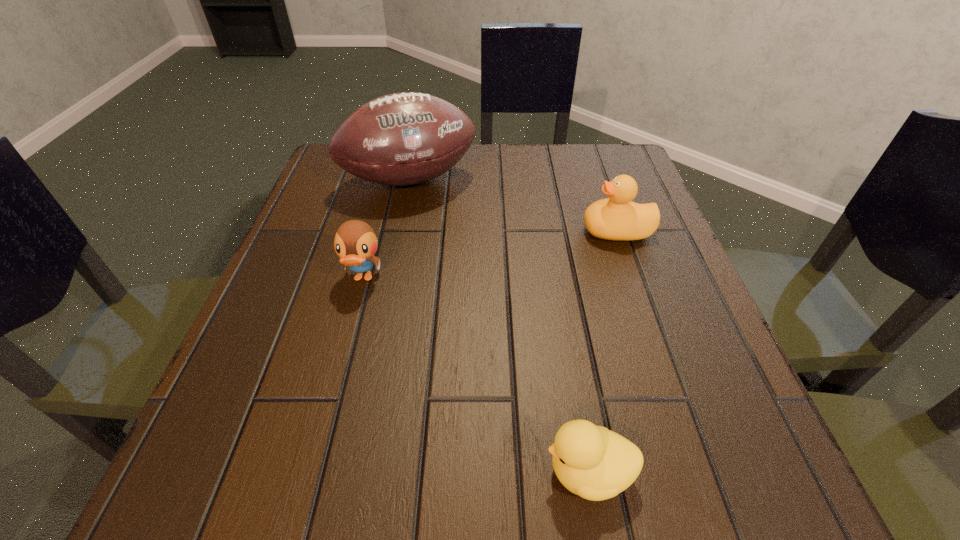
The width and height of the screenshot is (960, 540). I want to click on empty location between the shortest duck and the third nearest object, so click(603, 352).

Locate an element on the screen. vacant space that's between the nearest duck and the second farthest duck is located at coordinates (476, 375).

The image size is (960, 540). In order to click on free space between the rightmost object and the second object from right to left in this screenshot , I will do `click(603, 352)`.

Where is `empty space that is in between the farthest object and the leftmost duck`? This screenshot has height=540, width=960. empty space that is in between the farthest object and the leftmost duck is located at coordinates (386, 230).

Image resolution: width=960 pixels, height=540 pixels. What are the coordinates of `vacant space in between the football (American) and the farthest duck` in the screenshot? It's located at (514, 206).

Locate an element on the screen. blank region between the shortest duck and the farthest object is located at coordinates (499, 326).

You are a GUI agent. You are given a task and a screenshot of the screen. Output one action in this format:
    pyautogui.click(x=<x>, y=<y>)
    Task: Click on the empty space that is in between the football (American) and the second duck from left to right
    The height and width of the screenshot is (540, 960).
    Given the screenshot: What is the action you would take?
    pyautogui.click(x=499, y=326)

Locate an element on the screen. free point between the football (American) and the rightmost object is located at coordinates (514, 206).

Identify which object is located as the second nearest to the second duck from left to right. Please provide its 2D coordinates. Your answer should be formatted as a tuple, i.e. [(x, y)], where the tuple contains the x and y coordinates of a point satisfying the conditions above.

[(618, 218)]

Identify which object is located as the third nearest to the second duck from left to right. Please provide its 2D coordinates. Your answer should be formatted as a tuple, i.e. [(x, y)], where the tuple contains the x and y coordinates of a point satisfying the conditions above.

[(407, 138)]